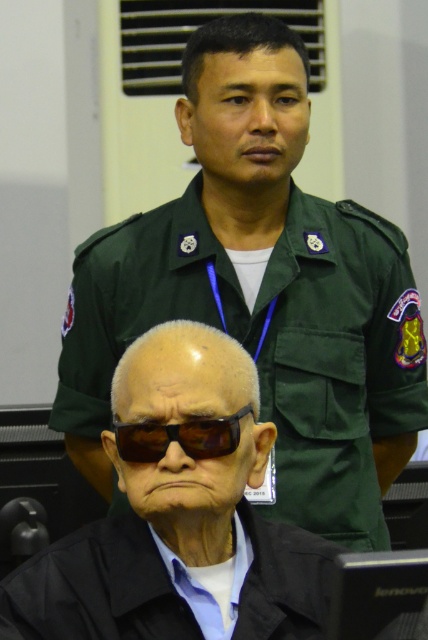
Is black matte sunglasses at lower center thinner than green fabric uniform at upper center?

Yes.

Who is higher up, black matte sunglasses at lower center or green fabric uniform at upper center?

black matte sunglasses at lower center is higher up.

At what (x,y) coordinates should I click in order to perform the action: click on black matte sunglasses at lower center. Please return your answer as a coordinate pair (x, y). The width and height of the screenshot is (428, 640). Looking at the image, I should click on (178, 515).

Which is in front, point (290, 540) or point (178, 442)?

Point (178, 442)

The height and width of the screenshot is (640, 428). Find the location of `green fabric uniform at upper center`. green fabric uniform at upper center is located at coordinates (97, 588).

Find the location of a particular element. Image resolution: width=428 pixels, height=640 pixels. green fabric uniform at upper center is located at coordinates (97, 588).

Does point (142, 486) come behind point (240, 408)?

That is False.

Can you confirm if black matte sunglasses at lower center is bigger than black plastic goggles at center?

Yes.

Measure the distance between black matte sunglasses at lower center and camera.

They are 1.49 meters apart.

At what (x,y) coordinates should I click in order to perform the action: click on black matte sunglasses at lower center. Please return your answer as a coordinate pair (x, y). This screenshot has height=640, width=428. Looking at the image, I should click on (178, 515).